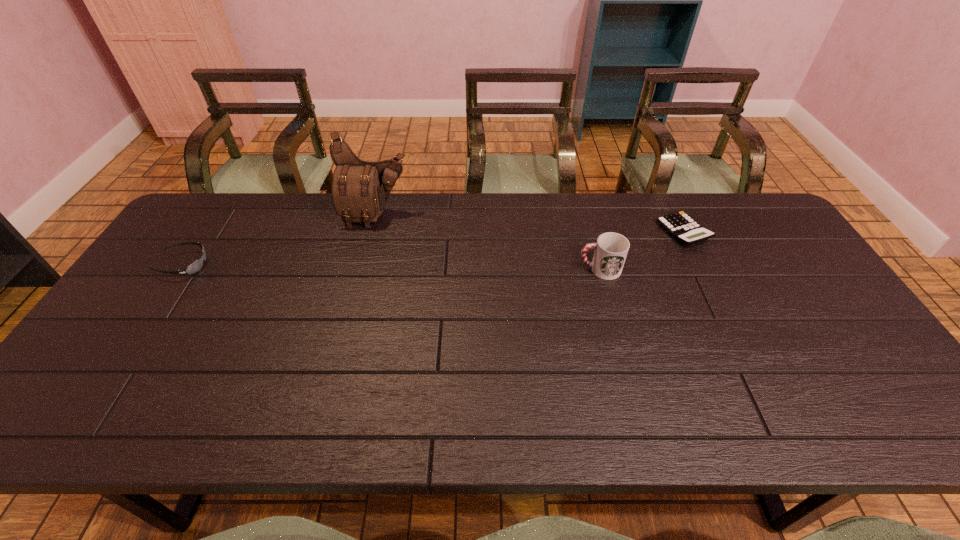
Find the location of a particular element. The image size is (960, 540). vacant space that satisfies the following two spatial constraints: 1. on the handle side of the cup; 2. on the lenses of the third tallest object is located at coordinates (598, 265).

Identify the location of free location that satisfies the following two spatial constraints: 1. on the front-facing side of the shoulder bag; 2. on the handle side of the third shortest object. (362, 269).

The image size is (960, 540). I want to click on free location that satisfies the following two spatial constraints: 1. on the handle side of the second object from right to left; 2. on the lenses of the second shortest object, so click(x=598, y=265).

Identify the location of free spot that satisfies the following two spatial constraints: 1. on the front-facing side of the shoulder bag; 2. on the handle side of the second tallest object. The image size is (960, 540). (362, 269).

In order to click on vacant space that satisfies the following two spatial constraints: 1. on the front-facing side of the calculator; 2. on the right side of the third object from right to left in this screenshot , I will do (372, 232).

Identify the location of vacant space that satisfies the following two spatial constraints: 1. on the front-facing side of the third object from right to left; 2. on the lenses of the third tallest object. [363, 265].

Image resolution: width=960 pixels, height=540 pixels. Find the location of `vacant space that satisfies the following two spatial constraints: 1. on the handle side of the rightmost object; 2. on the right side of the cup`. vacant space that satisfies the following two spatial constraints: 1. on the handle side of the rightmost object; 2. on the right side of the cup is located at coordinates point(589,232).

At what (x,y) coordinates should I click in order to perform the action: click on vacant space that satisfies the following two spatial constraints: 1. on the handle side of the third shortest object; 2. on the left side of the calculator. Please return your answer as a coordinate pair (x, y). The width and height of the screenshot is (960, 540). Looking at the image, I should click on (589, 232).

Where is `free spot that satisfies the following two spatial constraints: 1. on the handle side of the calculator; 2. on the right side of the cup`? free spot that satisfies the following two spatial constraints: 1. on the handle side of the calculator; 2. on the right side of the cup is located at coordinates tap(589, 232).

Locate an element on the screen. The height and width of the screenshot is (540, 960). vacant point that satisfies the following two spatial constraints: 1. on the handle side of the calculator; 2. on the right side of the cup is located at coordinates (589, 232).